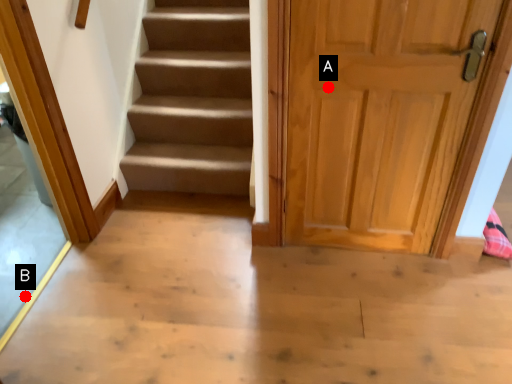
Question: Two points are circled on the image, labeled by A and B beside each circle. Among these points, which one is nearest to the camera?

Choices:
 (A) A is closer
 (B) B is closer

Answer: (A)